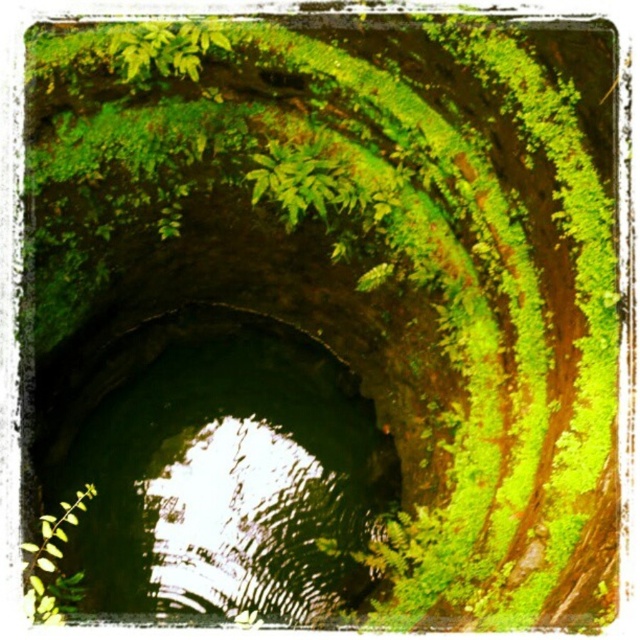
You are an explorer navigating through a forest and come across a mossy tunnel. You see a green mossy hole at center and a green leafy plant at lower left. Which object is wider?

The green mossy hole at center is wider than the green leafy plant at lower left.

You are standing at the entrance of the tunnel and want to reach the green leafy plant at lower left. Which direction should you move relative to the green mossy hole at center?

The green leafy plant at lower left is behind the green mossy hole at center, so you should move backward away from the entrance towards the green mossy hole at center to reach it.

You are an explorer in a forest and need to determine which object is bigger between the green mossy hole at center and the green leafy plant at lower left. Can you identify the larger one?

The green mossy hole at center is larger in size than the green leafy plant at lower left.